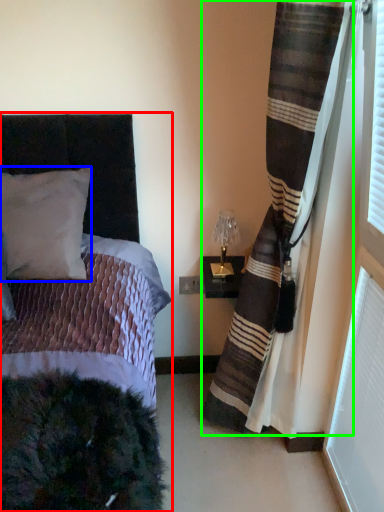
Question: Which object is positioned farthest from bed (highlighted by a red box)? Select from pillow (highlighted by a blue box) and curtain (highlighted by a green box).

Choices:
 (A) pillow
 (B) curtain

Answer: (B)